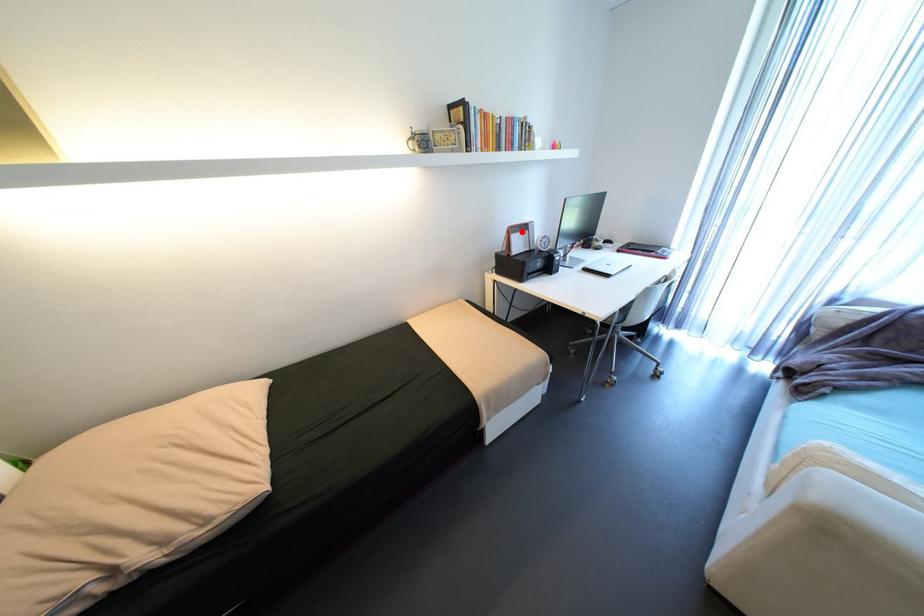
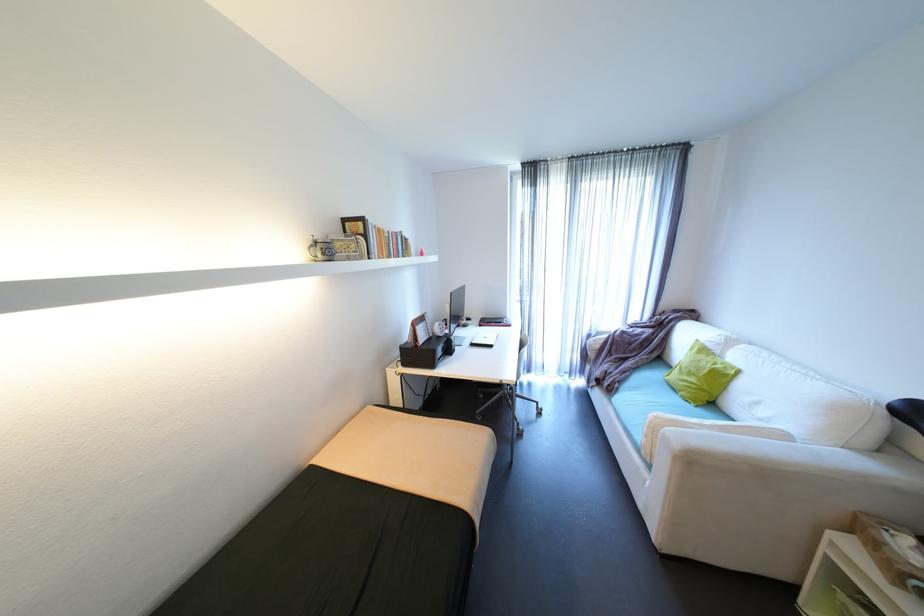
In the second image, find the point that corresponds to the highlighted location in the first image.

(426, 323)